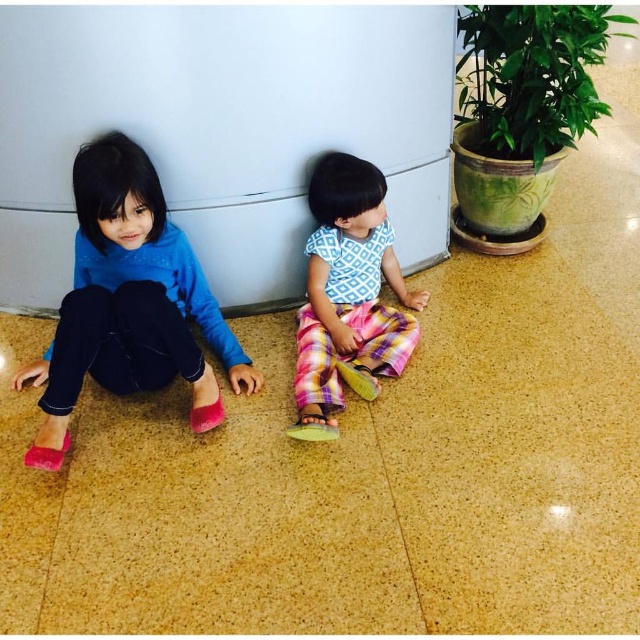
Question: Can you confirm if matte pink shoes at left is thinner than plaid fabric pants at center?

Choices:
 (A) no
 (B) yes

Answer: (A)

Question: Which of the following is the closest to the observer?

Choices:
 (A) matte pink shoes at left
 (B) plaid fabric pants at center

Answer: (A)

Question: Observing the image, what is the correct spatial positioning of matte pink shoes at left in reference to plaid fabric pants at center?

Choices:
 (A) above
 (B) below

Answer: (A)

Question: Does matte pink shoes at left appear on the left side of plaid fabric pants at center?

Choices:
 (A) no
 (B) yes

Answer: (B)

Question: Which point is closer to the camera?

Choices:
 (A) plaid fabric pants at center
 (B) matte pink shoes at left

Answer: (B)